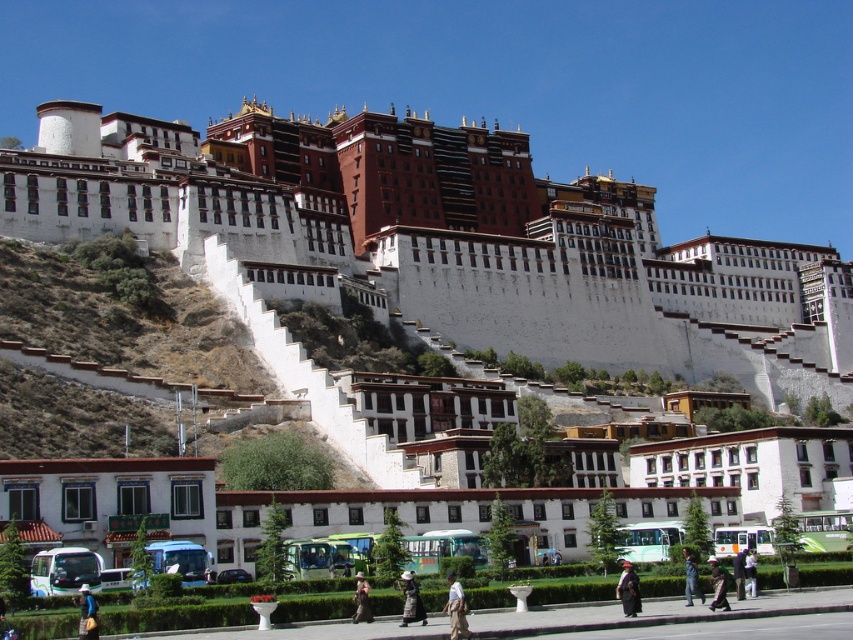
Question: Which of the following is the farthest from the observer?

Choices:
 (A) dark brown leather jacket at center
 (B) dark brown fabric at lower right
 (C) dark gray fabric umbrella at lower center
 (D) brown fabric hat at lower center

Answer: (D)

Question: Can you confirm if dark brown leather jacket at center is positioned to the left of dark brown fabric at lower right?

Choices:
 (A) yes
 (B) no

Answer: (A)

Question: Is the position of light brown fabric bag at lower left less distant than that of dark blue fabric coat at lower right?

Choices:
 (A) yes
 (B) no

Answer: (A)

Question: Estimate the real-world distances between objects in this image. Which object is closer to the dark brown leather jacket at center?

Choices:
 (A) light brown fabric bag at lower left
 (B) brown fabric hat at lower center
 (C) dark blue uniform at lower center

Answer: (B)

Question: Is dark brown fabric at lower right positioned behind dark blue uniform at lower center?

Choices:
 (A) no
 (B) yes

Answer: (A)

Question: Based on their relative distances, which object is nearer to the light brown fabric bag at lower left?

Choices:
 (A) dark blue uniform at lower center
 (B) dark gray fabric umbrella at lower center

Answer: (B)